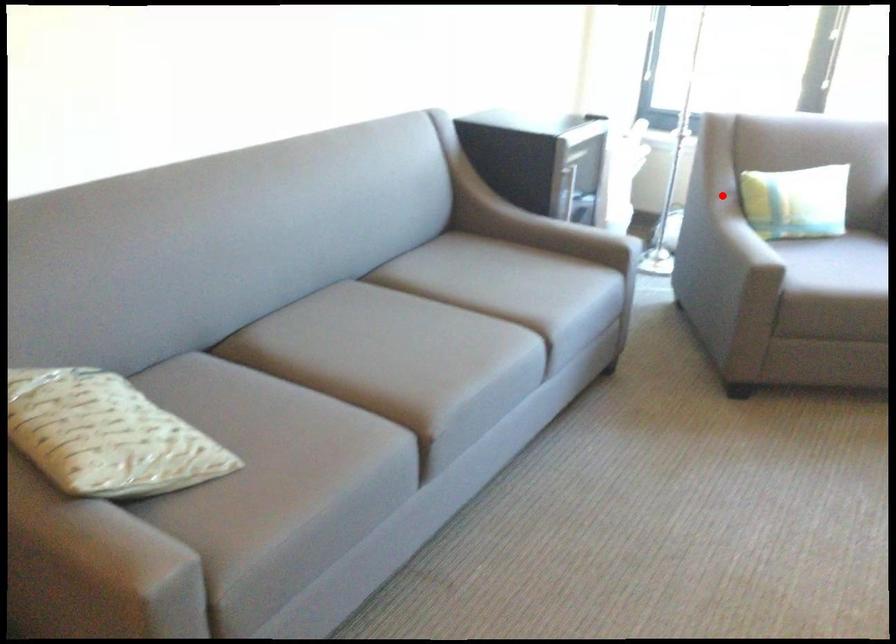
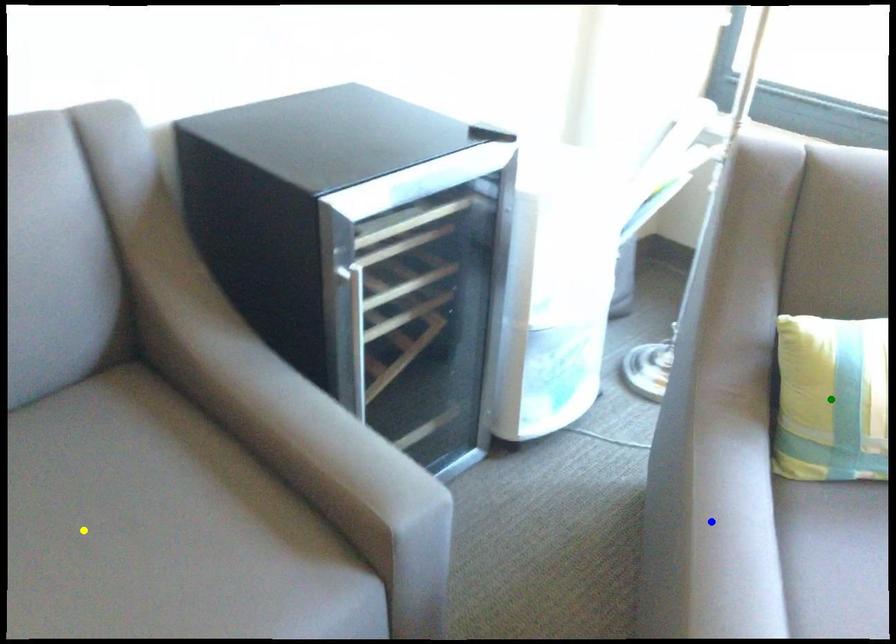
Question: I am providing you with two images of the same scene from different viewpoints. A red point is marked on the first image. You are given multiple points on the second image. In image 2, which mark is for the same physical point as the one in image 1?

Choices:
 (A) green point
 (B) blue point
 (C) yellow point

Answer: (A)